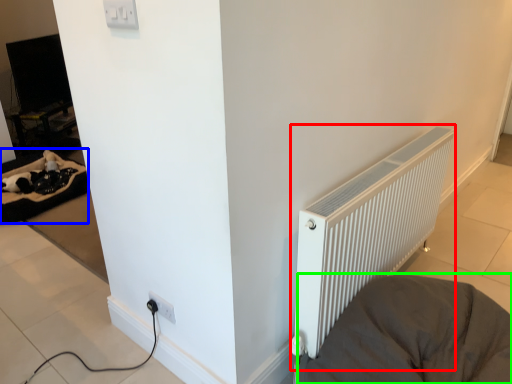
Question: Estimate the real-world distances between objects in this image. Which object is farther from radiator (highlighted by a red box), bedding (highlighted by a blue box) or furniture (highlighted by a green box)?

Choices:
 (A) bedding
 (B) furniture

Answer: (A)